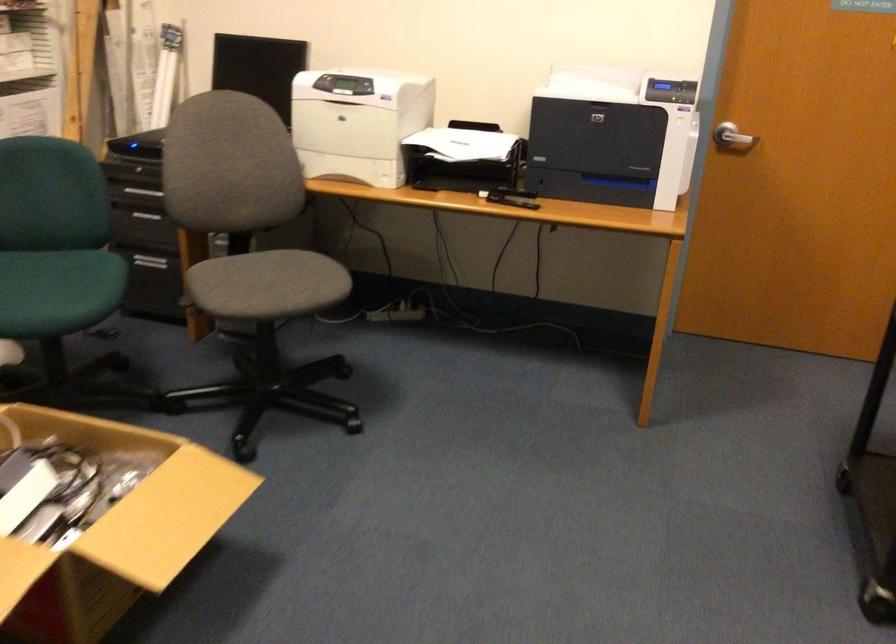
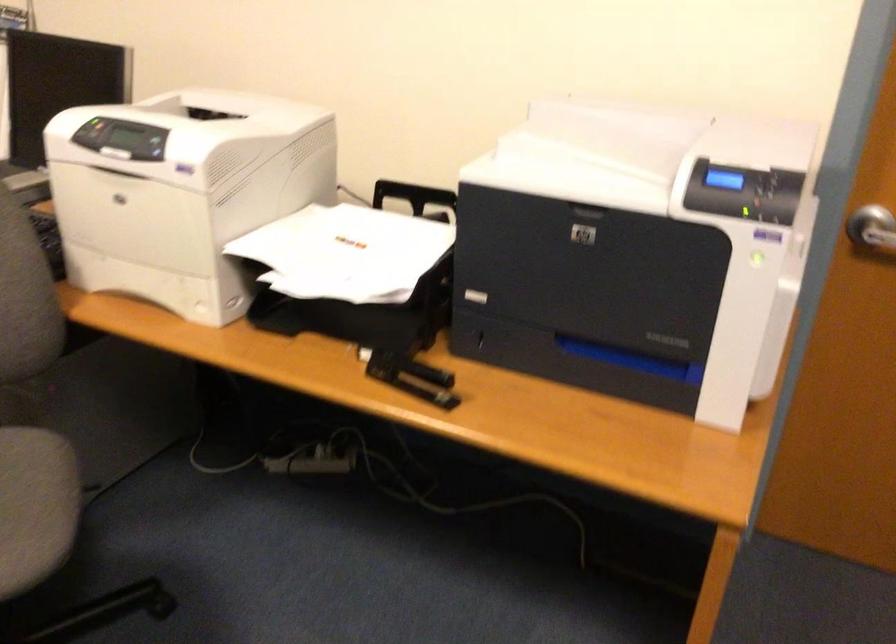
The point at (363, 82) is marked in the first image. Where is the corresponding point in the second image?

(151, 144)